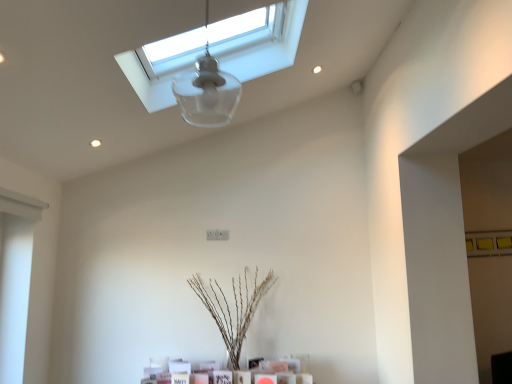
The width and height of the screenshot is (512, 384). Describe the element at coordinates (207, 91) in the screenshot. I see `transparent glass lampshade at upper center` at that location.

What is the approximate height of transparent glass window at upper center?

transparent glass window at upper center is 19.75 inches in height.

The width and height of the screenshot is (512, 384). In order to click on transparent glass lampshade at upper center in this screenshot , I will do `click(207, 91)`.

Is brown textured plant at center bigger than transparent glass lampshade at upper center?

Correct, brown textured plant at center is larger in size than transparent glass lampshade at upper center.

Image resolution: width=512 pixels, height=384 pixels. In order to click on plant beneath the transparent glass lampshade at upper center (from a real-world perspective) in this screenshot , I will do `click(234, 308)`.

Is brown textured plant at center smaller than transparent glass window at upper center?

Yes, brown textured plant at center is smaller than transparent glass window at upper center.

In terms of height, does brown textured plant at center look taller or shorter compared to transparent glass window at upper center?

In the image, brown textured plant at center appears to be taller than transparent glass window at upper center.

Is brown textured plant at center completely or partially outside of transparent glass window at upper center?

Yes, brown textured plant at center is not within transparent glass window at upper center.

Can you confirm if transparent glass window at upper center is wider than brown textured plant at center?

Correct, the width of transparent glass window at upper center exceeds that of brown textured plant at center.

Considering the sizes of transparent glass window at upper center and brown textured plant at center in the image, is transparent glass window at upper center taller or shorter than brown textured plant at center?

Clearly, transparent glass window at upper center is shorter compared to brown textured plant at center.

Considering the points (167, 84) and (238, 369), which point is behind, point (167, 84) or point (238, 369)?

Point (238, 369)

From the image's perspective, is transparent glass window at upper center beneath brown textured plant at center?

No, from the image's perspective, transparent glass window at upper center is not beneath brown textured plant at center.

Are transparent glass lampshade at upper center and transparent glass window at upper center beside each other?

No, transparent glass lampshade at upper center is not with transparent glass window at upper center.

Which object is further away from the camera, transparent glass lampshade at upper center or transparent glass window at upper center?

transparent glass window at upper center is more distant.

Considering the relative sizes of transparent glass lampshade at upper center and transparent glass window at upper center in the image provided, is transparent glass lampshade at upper center wider than transparent glass window at upper center?

In fact, transparent glass lampshade at upper center might be narrower than transparent glass window at upper center.

Can you tell me how much transparent glass lampshade at upper center and transparent glass window at upper center differ in facing direction?

88.1 degrees.

Consider the image. Can you confirm if transparent glass window at upper center is thinner than transparent glass lampshade at upper center?

In fact, transparent glass window at upper center might be wider than transparent glass lampshade at upper center.

Considering the positions of point (150, 101) and point (201, 107), is point (150, 101) closer or farther from the camera than point (201, 107)?

Point (150, 101) is positioned closer to the camera compared to point (201, 107).

Is transparent glass window at upper center taller or shorter than transparent glass lampshade at upper center?

In the image, transparent glass window at upper center appears to be taller than transparent glass lampshade at upper center.

Between transparent glass lampshade at upper center and brown textured plant at center, which one is positioned in front?

transparent glass lampshade at upper center is closer to the camera.

Who is taller, transparent glass lampshade at upper center or brown textured plant at center?

Standing taller between the two is brown textured plant at center.

Which is more distant, [195,74] or [242,293]?

Positioned behind is point [242,293].

Is transparent glass lampshade at upper center with brown textured plant at center?

No, transparent glass lampshade at upper center is not next to brown textured plant at center.

Identify the location of plant on the left of transparent glass lampshade at upper center. (234, 308).

Where is `plant behind the transparent glass window at upper center`? The width and height of the screenshot is (512, 384). plant behind the transparent glass window at upper center is located at coordinates (234, 308).

Estimate the real-world distances between objects in this image. Which object is further from transparent glass lampshade at upper center, transparent glass window at upper center or brown textured plant at center?

brown textured plant at center.

Which object lies further to the anchor point transparent glass window at upper center, transparent glass lampshade at upper center or brown textured plant at center?

Among the two, brown textured plant at center is located further to transparent glass window at upper center.

Estimate the real-world distances between objects in this image. Which object is closer to transparent glass window at upper center, brown textured plant at center or transparent glass lampshade at upper center?

Among the two, transparent glass lampshade at upper center is located nearer to transparent glass window at upper center.

Considering their positions, is transparent glass window at upper center positioned further to brown textured plant at center than transparent glass lampshade at upper center?

The object further to brown textured plant at center is transparent glass window at upper center.

Which object lies nearer to the anchor point transparent glass lampshade at upper center, brown textured plant at center or transparent glass window at upper center?

transparent glass window at upper center is positioned closer to the anchor transparent glass lampshade at upper center.

Looking at the image, which one is located further to brown textured plant at center, transparent glass lampshade at upper center or transparent glass window at upper center?

transparent glass window at upper center.

Find the location of `lamp between transparent glass window at upper center and brown textured plant at center vertically`. lamp between transparent glass window at upper center and brown textured plant at center vertically is located at coordinates (207, 91).